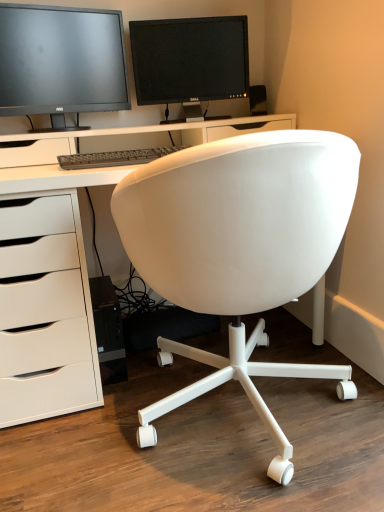
Question: From a real-world perspective, is white matte office chair at center beneath white matte desk at center?

Choices:
 (A) no
 (B) yes

Answer: (A)

Question: Can you confirm if white matte office chair at center is taller than white matte desk at center?

Choices:
 (A) yes
 (B) no

Answer: (B)

Question: Considering the relative sizes of white matte office chair at center and white matte desk at center in the image provided, is white matte office chair at center smaller than white matte desk at center?

Choices:
 (A) yes
 (B) no

Answer: (A)

Question: Is white matte office chair at center further to camera compared to white matte desk at center?

Choices:
 (A) yes
 (B) no

Answer: (B)

Question: From a real-world perspective, does white matte office chair at center stand above white matte desk at center?

Choices:
 (A) no
 (B) yes

Answer: (B)

Question: Is white matte office chair at center positioned beyond the bounds of white matte desk at center?

Choices:
 (A) yes
 (B) no

Answer: (B)

Question: From the image's perspective, is matte black speaker at upper right located beneath matte black monitor at upper center, the 2th computer monitor positioned from the left?

Choices:
 (A) no
 (B) yes

Answer: (B)

Question: Can you confirm if matte black speaker at upper right is positioned to the left of matte black monitor at upper center, the 2th computer monitor positioned from the left?

Choices:
 (A) yes
 (B) no

Answer: (B)

Question: Is matte black speaker at upper right further to camera compared to matte black monitor at upper center, the 2th computer monitor positioned from the left?

Choices:
 (A) yes
 (B) no

Answer: (A)

Question: Does matte black speaker at upper right come in front of matte black monitor at upper center, which is the first computer monitor from right to left?

Choices:
 (A) yes
 (B) no

Answer: (B)

Question: From a real-world perspective, is matte black speaker at upper right located higher than matte black monitor at upper center, which is the first computer monitor from right to left?

Choices:
 (A) yes
 (B) no

Answer: (B)

Question: Does matte black speaker at upper right have a larger size compared to matte black monitor at upper center, the 2th computer monitor positioned from the left?

Choices:
 (A) yes
 (B) no

Answer: (B)

Question: Can you confirm if matte black monitor at upper center, the 2th computer monitor positioned from the left, is smaller than matte black monitor at upper left, the first computer monitor viewed from the left?

Choices:
 (A) no
 (B) yes

Answer: (B)